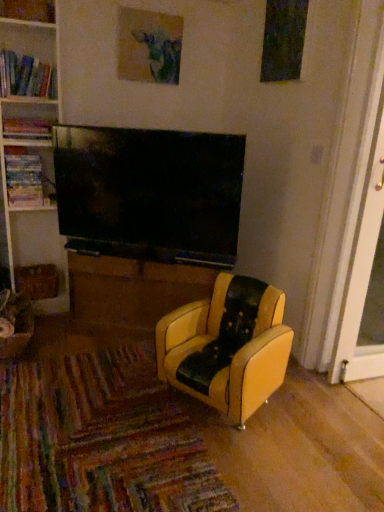
You are a GUI agent. You are given a task and a screenshot of the screen. Output one action in this format:
    pyautogui.click(x=<x>, y=<y>)
    Task: Click on the blank space situated above multicolored cardboard book at left, the third book when ordered from top to bottom (from a real-world perspective)
    
    Given the screenshot: What is the action you would take?
    pyautogui.click(x=31, y=148)